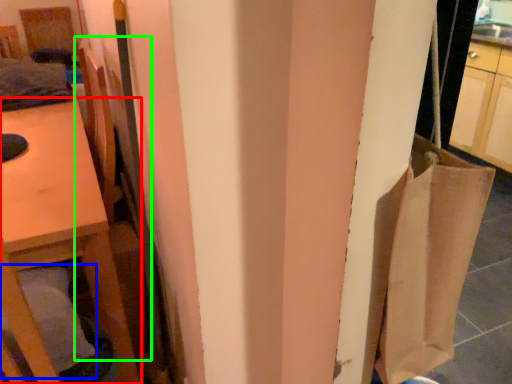
Question: Which object is the farthest from furniture (highlighted by a red box)? Choose among these: pillow (highlighted by a blue box) or chair (highlighted by a green box).

Choices:
 (A) pillow
 (B) chair

Answer: (A)